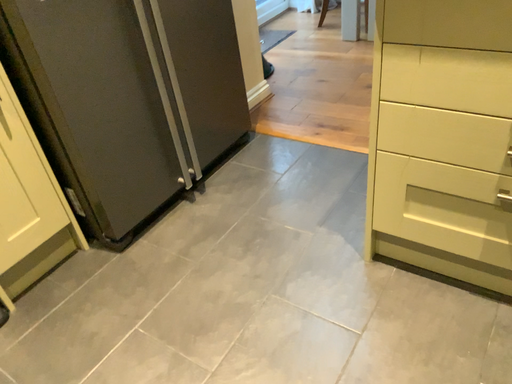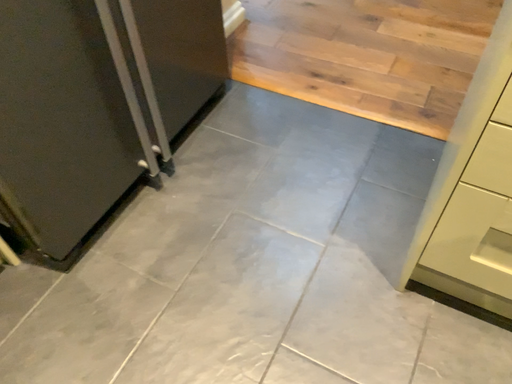
Question: How did the camera likely rotate when shooting the video?

Choices:
 (A) rotated downward
 (B) rotated upward

Answer: (A)